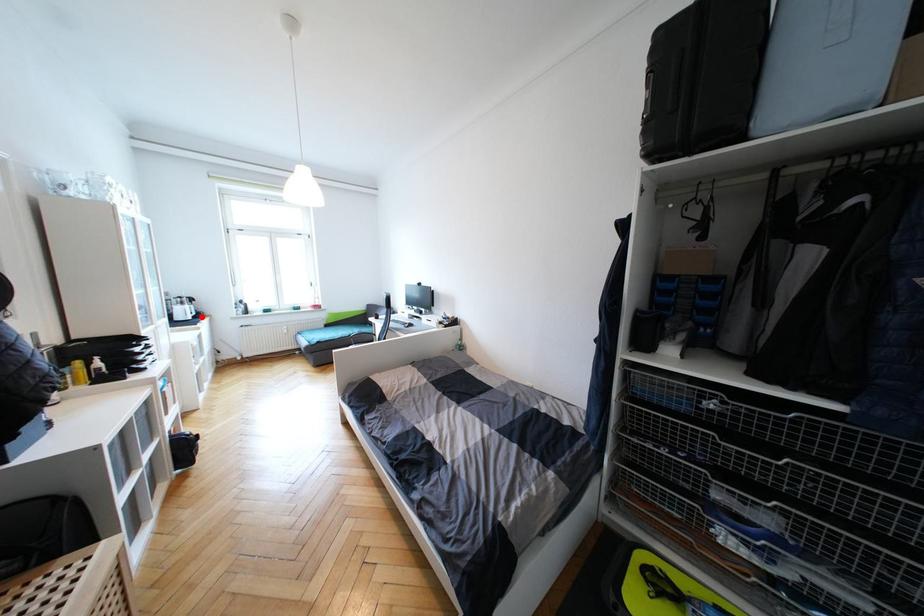
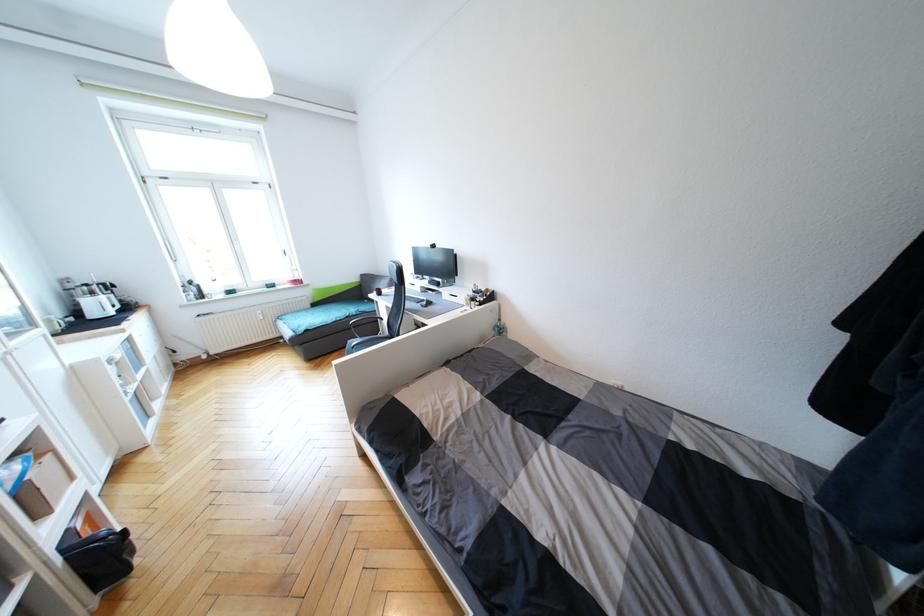
In the second image, find the point that corresponds to the highlighted location in the first image.

(130, 309)